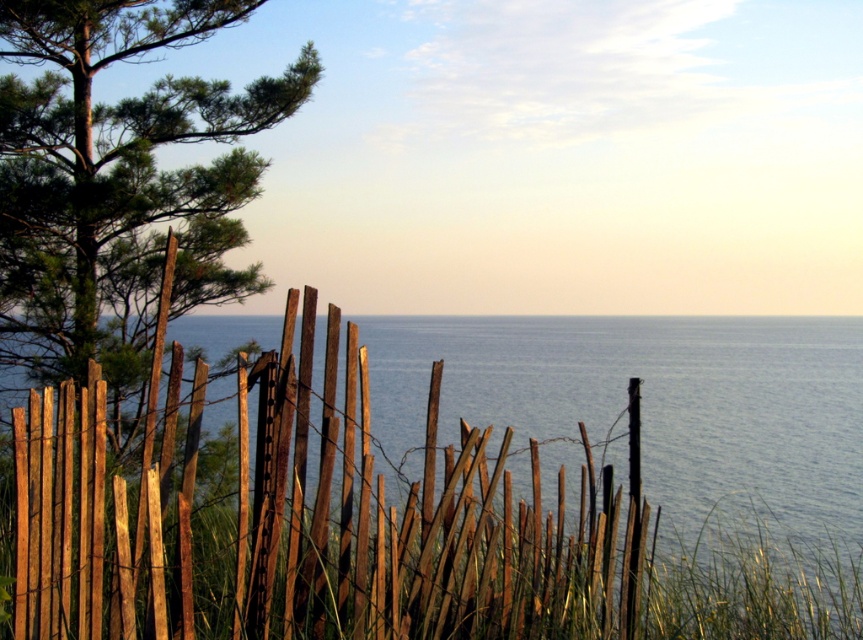
Question: Is the position of weathered wood fence at center more distant than that of green matte tree at upper left?

Choices:
 (A) yes
 (B) no

Answer: (B)

Question: Can you confirm if weathered wood fence at center is positioned to the right of green matte tree at upper left?

Choices:
 (A) yes
 (B) no

Answer: (A)

Question: Which point is farther to the camera?

Choices:
 (A) coord(139,280)
 (B) coord(73,387)

Answer: (A)

Question: Which point appears farthest from the camera in this image?

Choices:
 (A) (426, 636)
 (B) (219, 138)

Answer: (B)

Question: Considering the relative positions of weathered wood fence at center and green matte tree at upper left in the image provided, where is weathered wood fence at center located with respect to green matte tree at upper left?

Choices:
 (A) below
 (B) above

Answer: (A)